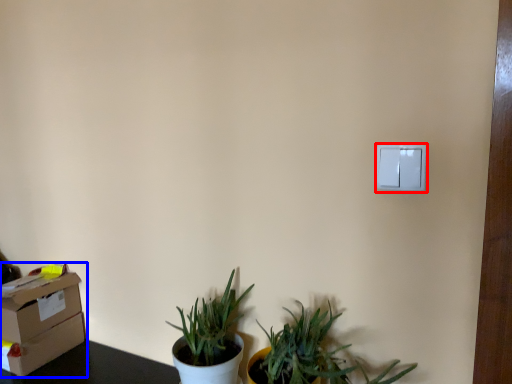
Question: Among these objects, which one is nearest to the camera, light switch (highlighted by a red box) or cardboard box (highlighted by a blue box)?

Choices:
 (A) light switch
 (B) cardboard box

Answer: (A)